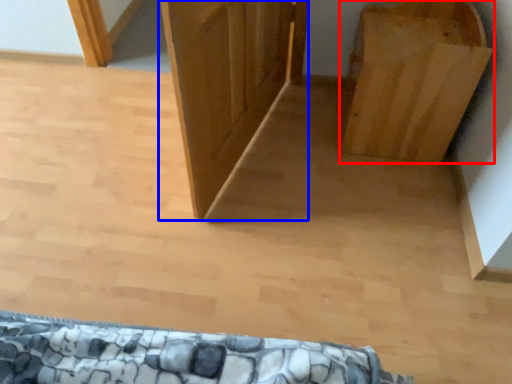
Question: Which object appears farthest to the camera in this image, furniture (highlighted by a red box) or door (highlighted by a blue box)?

Choices:
 (A) furniture
 (B) door

Answer: (A)